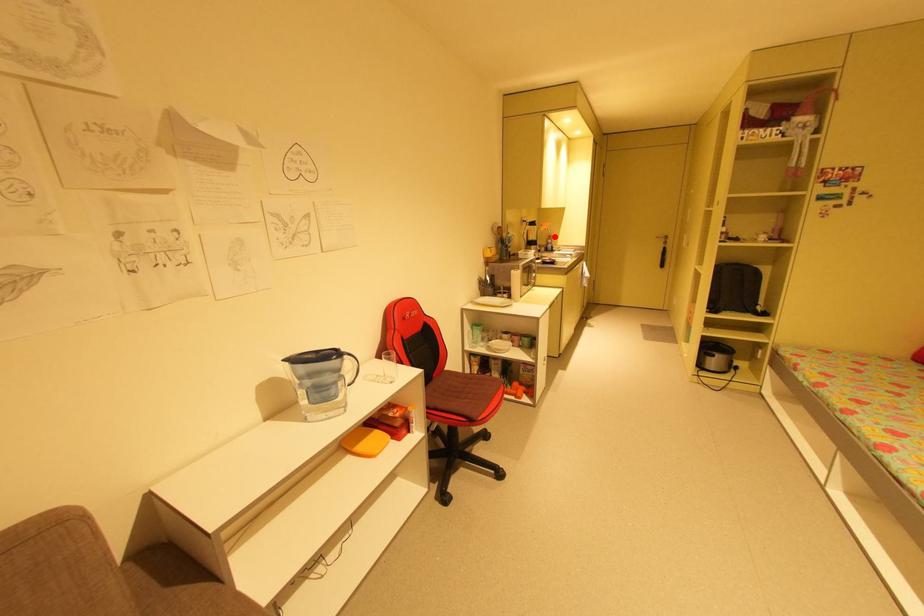
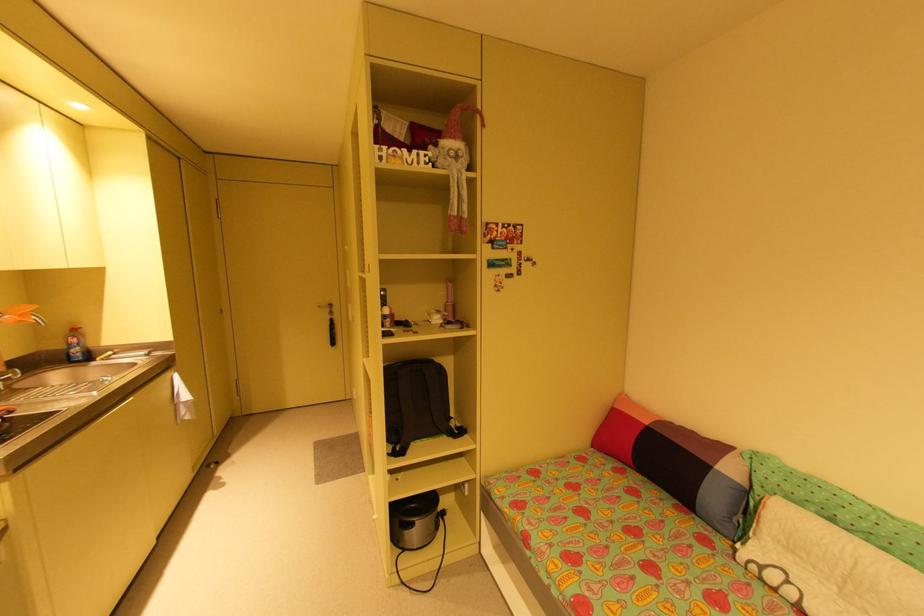
Locate, in the second image, the point that corresponds to the highlighted location in the first image.

(79, 331)